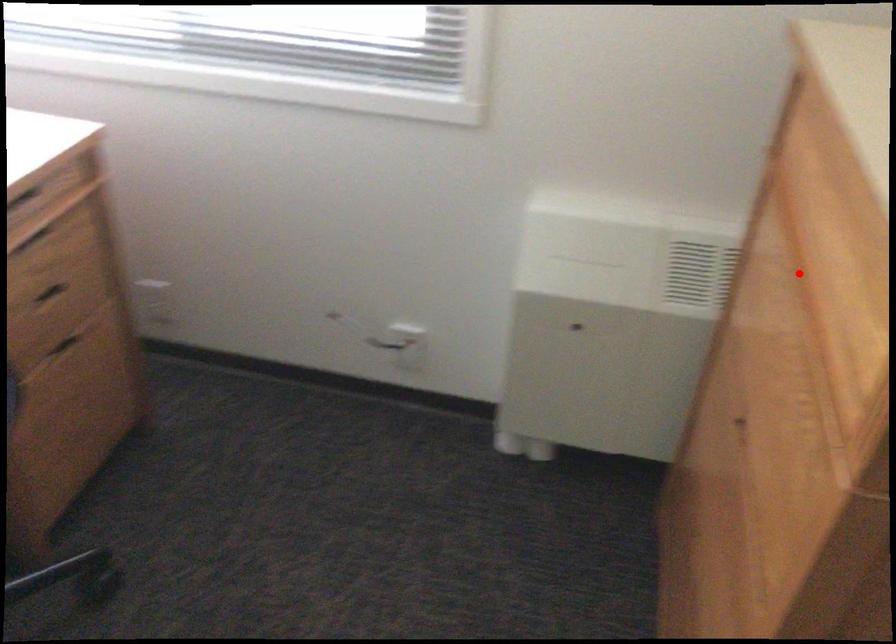
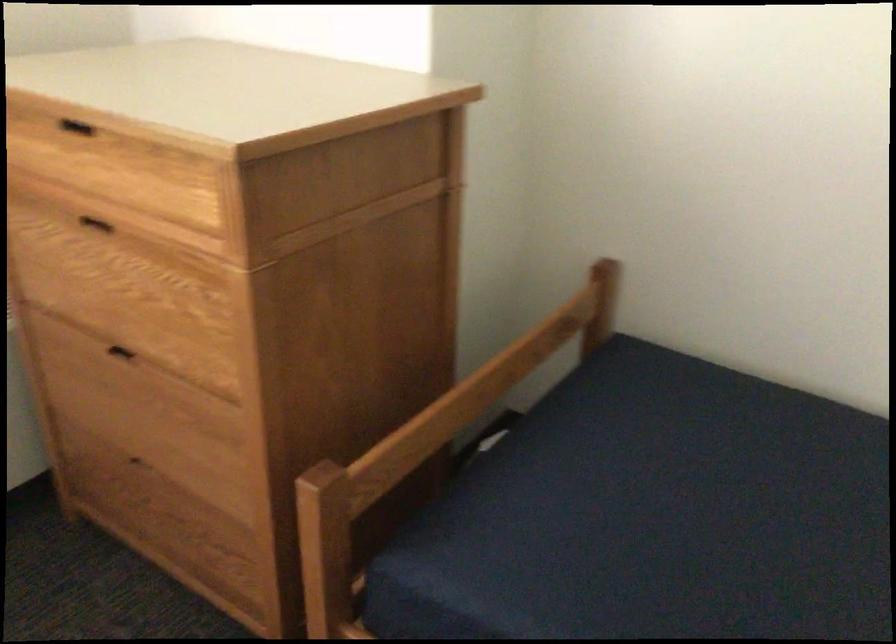
Question: I am providing you with two images of the same scene from different viewpoints. A red point is shown in image1. For the corresponding object point in image2, is it positioned nearer or farther from the camera?

Choices:
 (A) Nearer
 (B) Farther

Answer: (B)